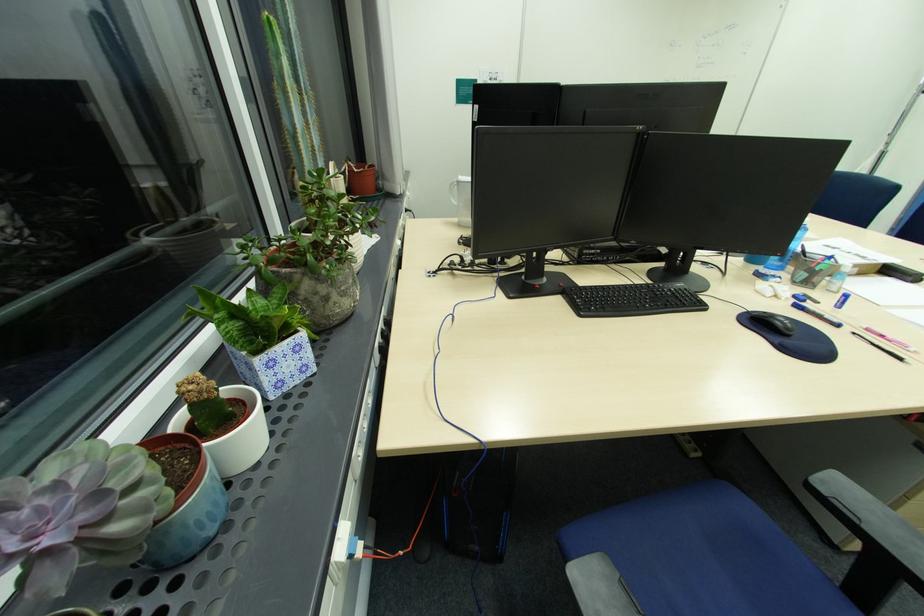
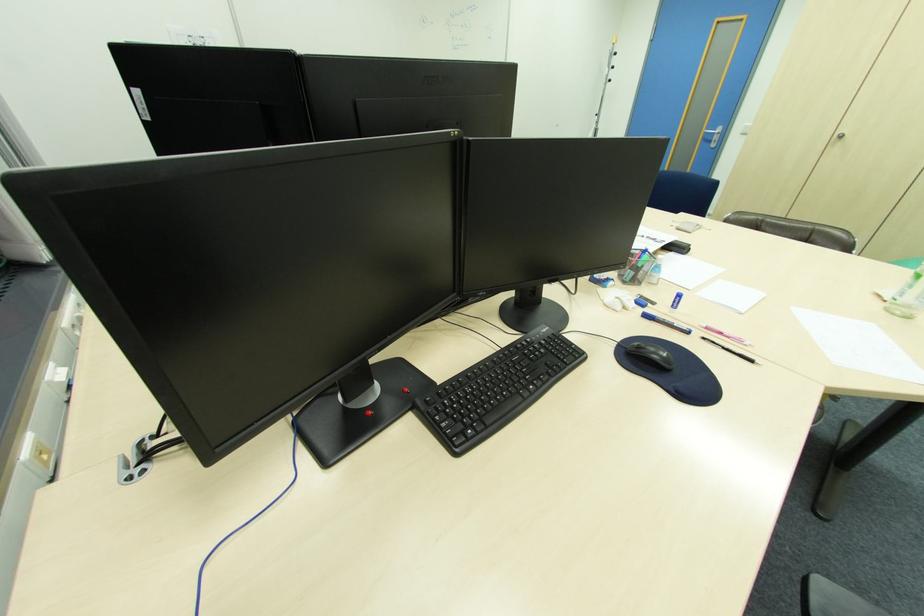
Question: The first image is from the beginning of the video and the second image is from the end. How did the camera likely rotate when shooting the video?

Choices:
 (A) Left
 (B) Right
 (C) Up
 (D) Down

Answer: (B)